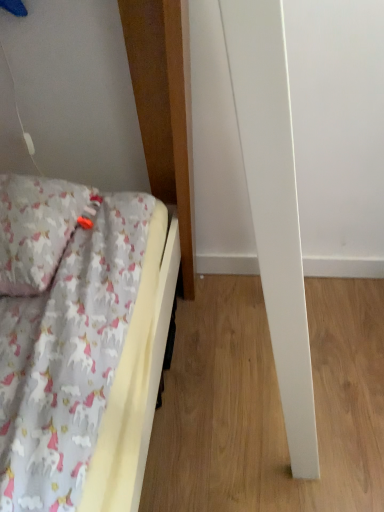
Question: Should I look upward or downward to see fluffy cotton pillow at left?

Choices:
 (A) down
 (B) up

Answer: (B)